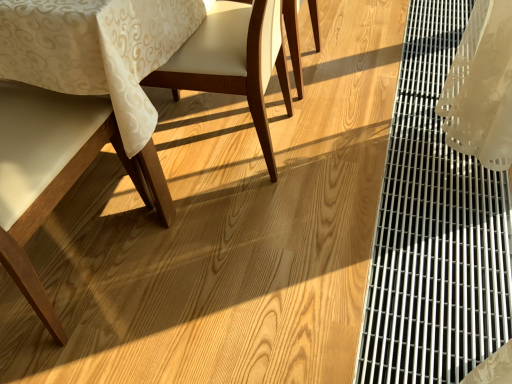
Question: Is matte wood chair at left, the third chair positioned from the right, surrounding metallic grid at right?

Choices:
 (A) no
 (B) yes

Answer: (A)

Question: Can you confirm if matte wood chair at left, the third chair positioned from the right, is smaller than metallic grid at right?

Choices:
 (A) no
 (B) yes

Answer: (A)

Question: Could you tell me if matte wood chair at left, the third chair positioned from the right, is turned towards metallic grid at right?

Choices:
 (A) yes
 (B) no

Answer: (B)

Question: Considering the relative sizes of matte wood chair at left, acting as the 2th chair starting from the left, and metallic grid at right in the image provided, is matte wood chair at left, acting as the 2th chair starting from the left, thinner than metallic grid at right?

Choices:
 (A) yes
 (B) no

Answer: (B)

Question: Is matte wood chair at left, acting as the 2th chair starting from the left, to the right of metallic grid at right from the viewer's perspective?

Choices:
 (A) no
 (B) yes

Answer: (A)

Question: Does matte wood chair at left, acting as the 2th chair starting from the left, have a greater width compared to metallic grid at right?

Choices:
 (A) no
 (B) yes

Answer: (B)

Question: From a real-world perspective, is metallic grid at right physically below matte wood chair at left, acting as the 2th chair starting from the left?

Choices:
 (A) yes
 (B) no

Answer: (A)

Question: From a real-world perspective, is metallic grid at right on top of matte wood chair at left, the third chair positioned from the right?

Choices:
 (A) no
 (B) yes

Answer: (A)

Question: Is metallic grid at right wider than matte wood chair at left, acting as the 2th chair starting from the left?

Choices:
 (A) no
 (B) yes

Answer: (A)

Question: Does metallic grid at right have a smaller size compared to matte wood chair at left, acting as the 2th chair starting from the left?

Choices:
 (A) yes
 (B) no

Answer: (A)

Question: Are metallic grid at right and matte wood chair at left, acting as the 2th chair starting from the left, far apart?

Choices:
 (A) no
 (B) yes

Answer: (A)

Question: Is metallic grid at right looking in the opposite direction of matte wood chair at left, acting as the 2th chair starting from the left?

Choices:
 (A) no
 (B) yes

Answer: (A)

Question: From the image's perspective, would you say matte wood chair at center, the second chair when ordered from right to left, is positioned over matte white chair at left, which ranks as the first chair in left-to-right order?

Choices:
 (A) yes
 (B) no

Answer: (A)